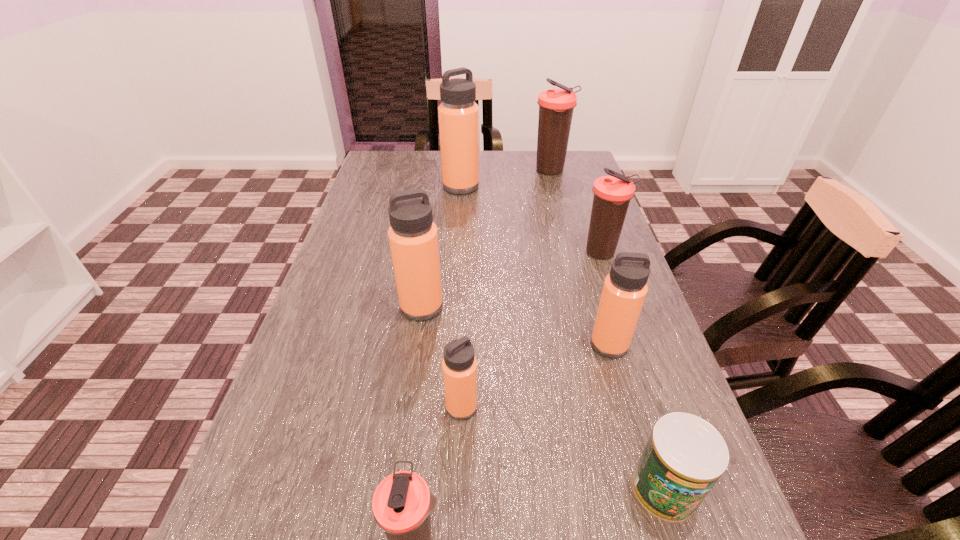
Where is `vacant region that satisfies the following two spatial constraints: 1. on the front side of the smallest orange thermos bottle; 2. on the left side of the tallest thermos bottle`? vacant region that satisfies the following two spatial constraints: 1. on the front side of the smallest orange thermos bottle; 2. on the left side of the tallest thermos bottle is located at coordinates (446, 407).

Image resolution: width=960 pixels, height=540 pixels. I want to click on free space in the image that satisfies the following two spatial constraints: 1. on the front side of the tallest thermos bottle; 2. on the right side of the third farthest thermos bottle, so click(x=457, y=253).

Identify the location of vacant area in the image that satisfies the following two spatial constraints: 1. on the back side of the fifth nearest thermos bottle; 2. on the left side of the can. This screenshot has height=540, width=960. (591, 253).

Locate an element on the screen. This screenshot has width=960, height=540. vacant region that satisfies the following two spatial constraints: 1. on the front side of the can; 2. on the right side of the biggest orange thermos bottle is located at coordinates coord(442,488).